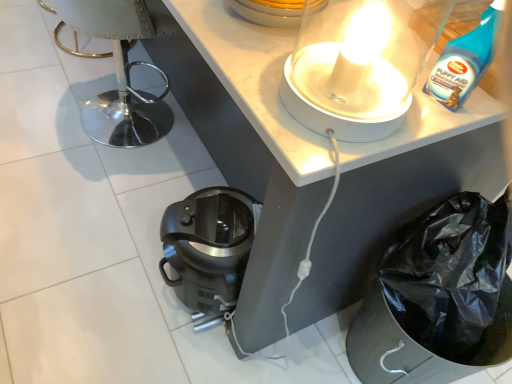
Image resolution: width=512 pixels, height=384 pixels. I want to click on free space in front of black plastic coffee maker at lower center, so click(x=179, y=350).